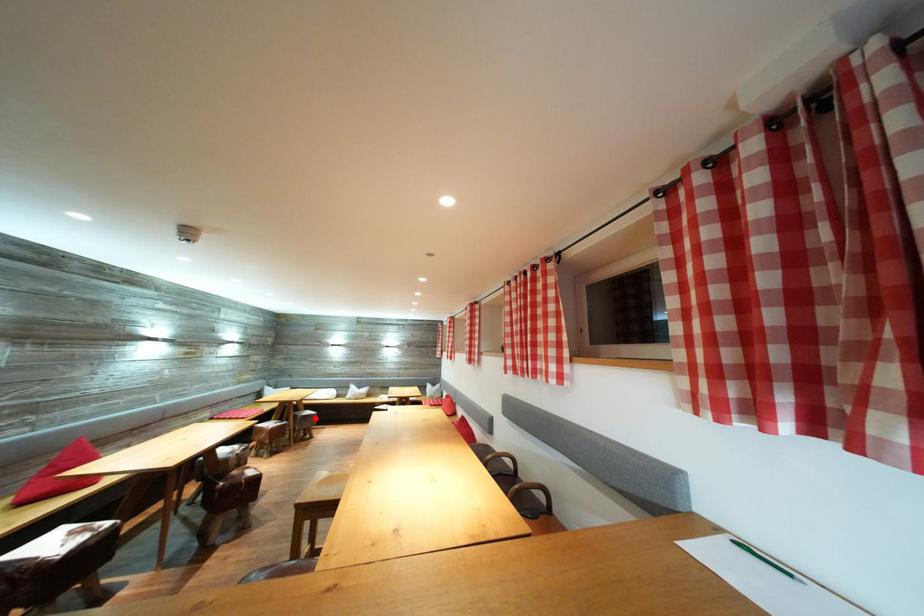
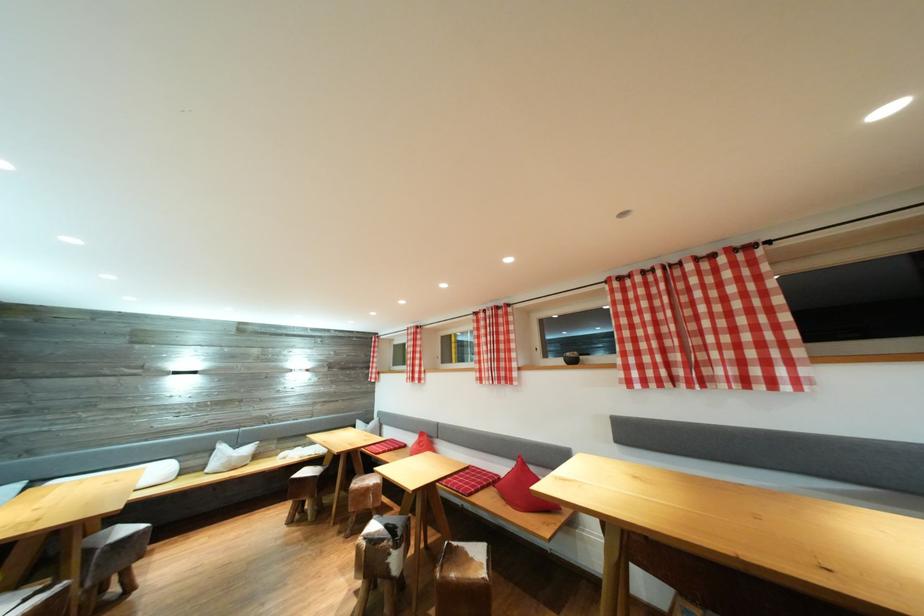
In the second image, find the point that corresponds to the highlighted location in the first image.

(131, 536)